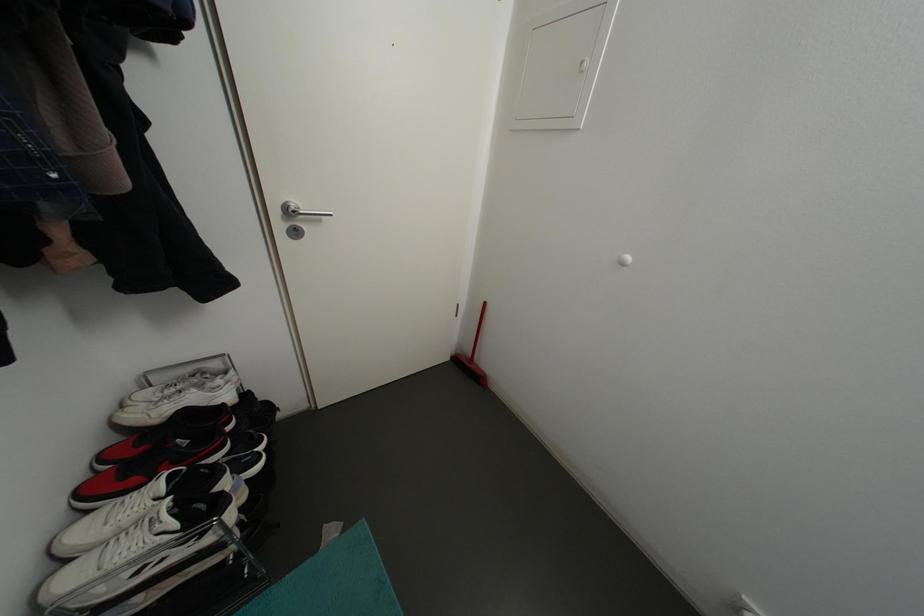
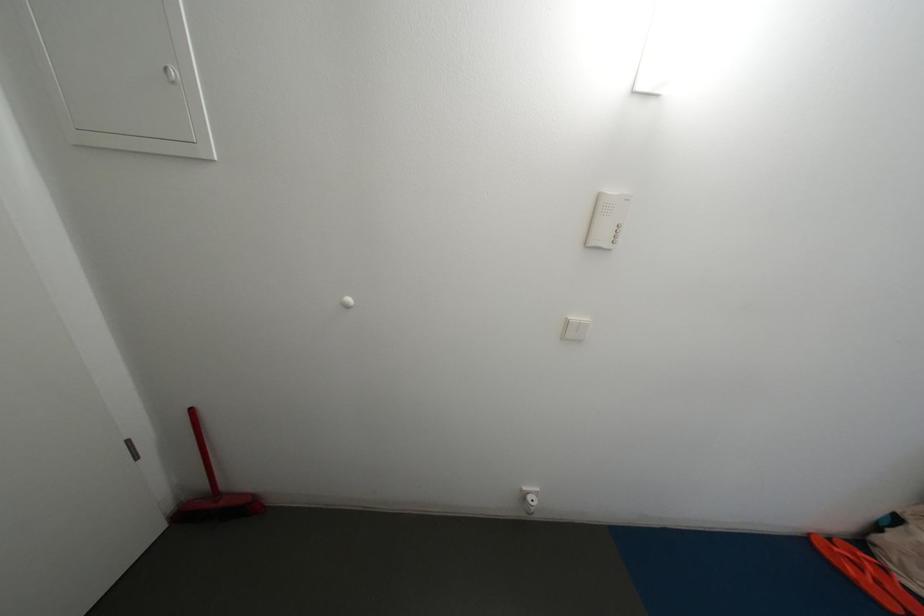
Question: The images are taken continuously from a first-person perspective. In which direction is your viewpoint rotating?

Choices:
 (A) Left
 (B) Right
 (C) Up
 (D) Down

Answer: (B)